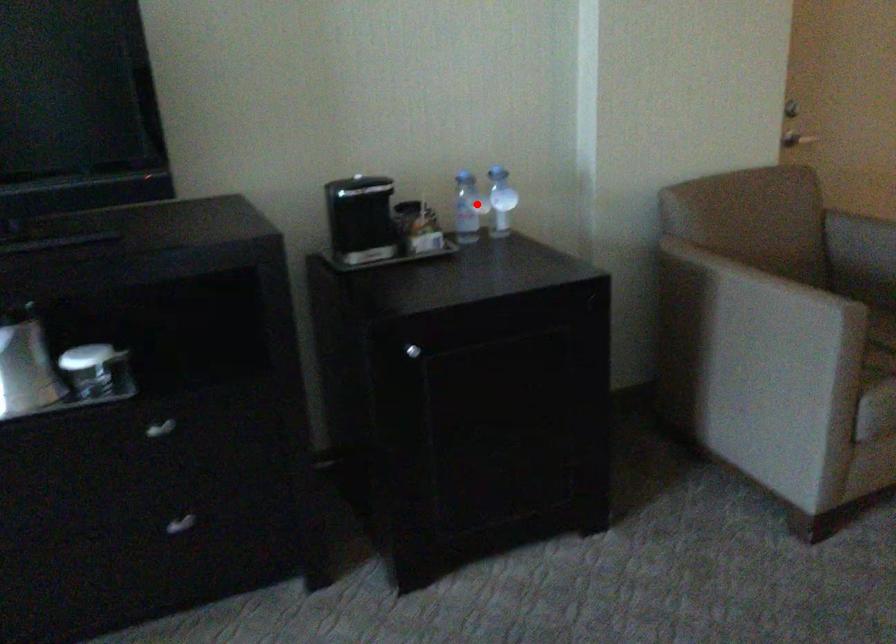
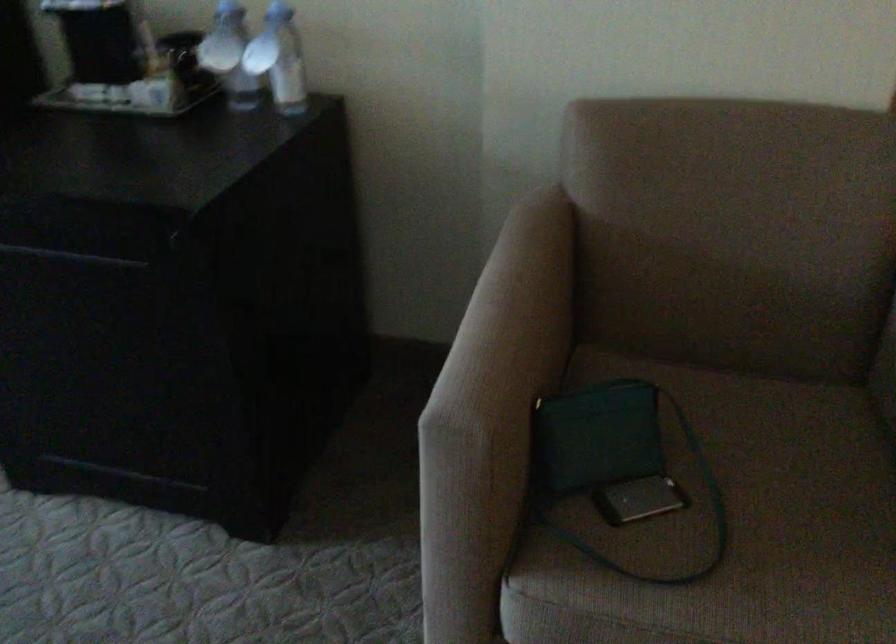
Find the pixel in the second image that matches the highlighted location in the first image.

(229, 55)